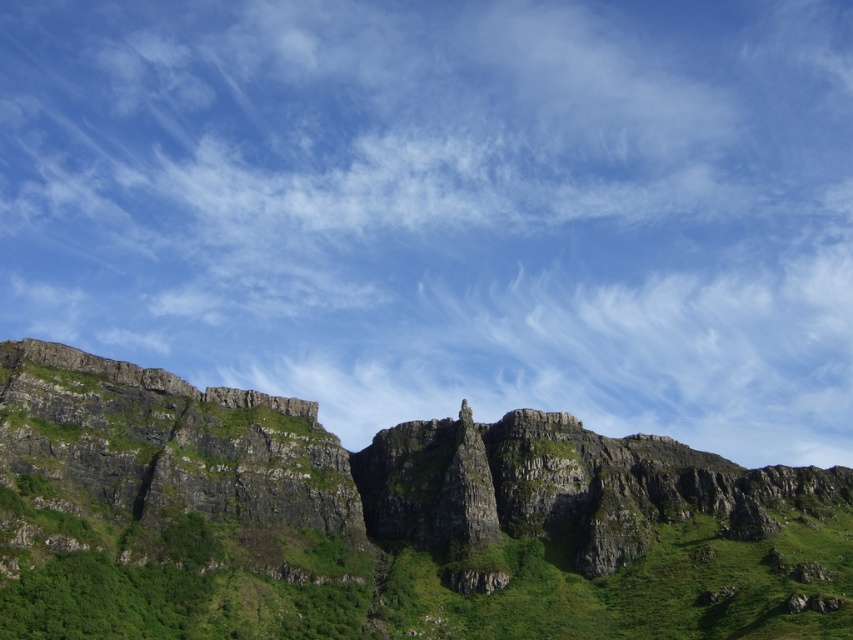
Question: Is white fluffy cloud at upper center behind rocky cliff at center?

Choices:
 (A) no
 (B) yes

Answer: (B)

Question: Where is white fluffy cloud at upper center located in relation to rocky cliff at center in the image?

Choices:
 (A) above
 (B) below

Answer: (A)

Question: Which point is closer to the camera?

Choices:
 (A) white fluffy cloud at upper center
 (B) rocky cliff at center

Answer: (B)

Question: In this image, where is white fluffy cloud at upper center located relative to rocky cliff at center?

Choices:
 (A) above
 (B) below

Answer: (A)